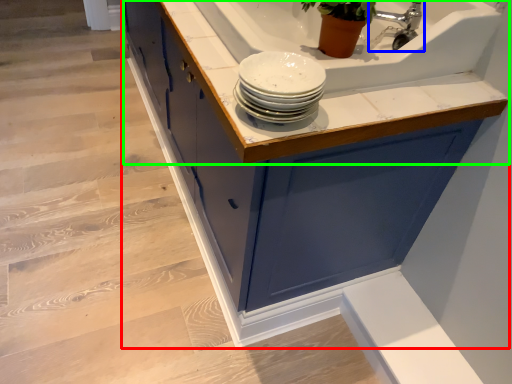
Question: Considering the real-world distances, which object is closest to cabinetry (highlighted by a red box)? tap (highlighted by a blue box) or countertop (highlighted by a green box).

Choices:
 (A) tap
 (B) countertop

Answer: (B)